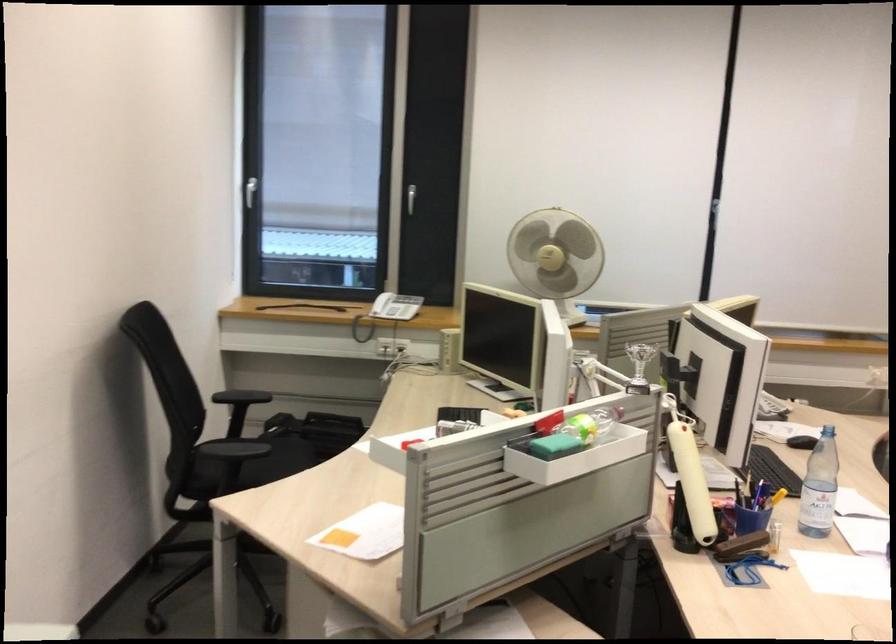
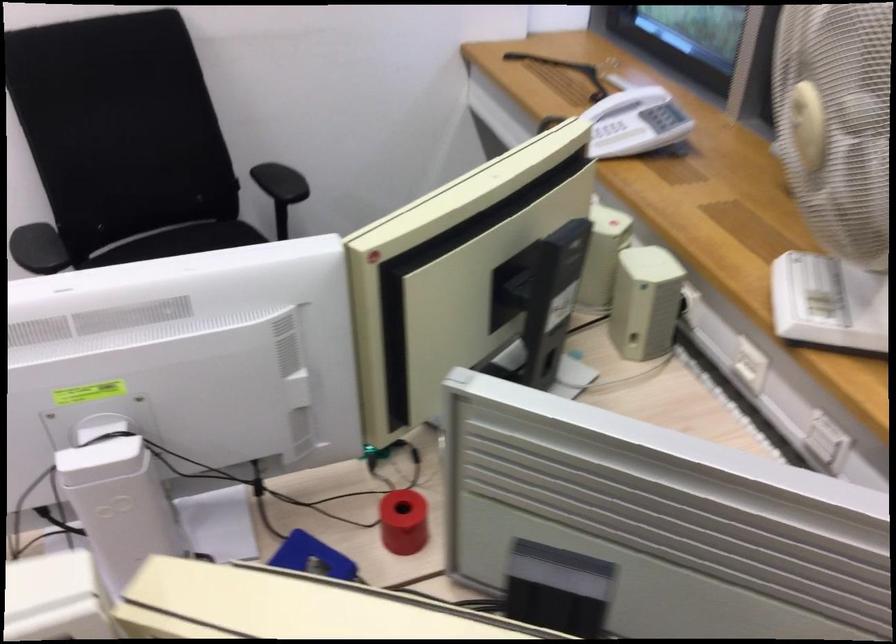
Find the pixel in the second image that matches point 536,243 in the first image.

(807, 125)